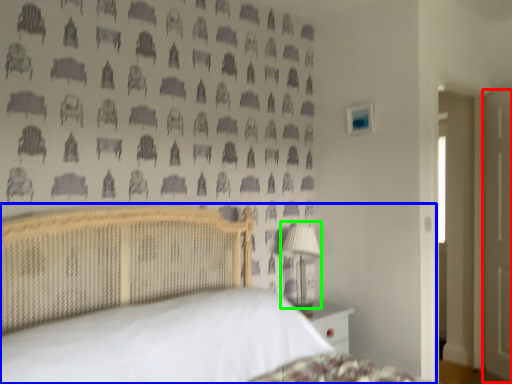
Question: Estimate the real-world distances between objects in this image. Which object is farther from door (highlighted by a red box), bed (highlighted by a blue box) or table lamp (highlighted by a green box)?

Choices:
 (A) bed
 (B) table lamp

Answer: (A)